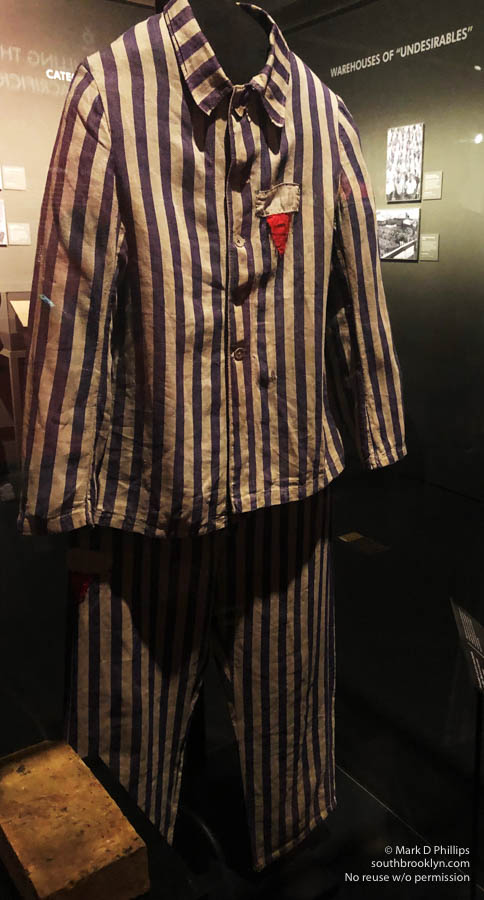
The height and width of the screenshot is (900, 484). In order to click on vertical black n white rectangular photo in this screenshot , I will do `click(402, 146)`.